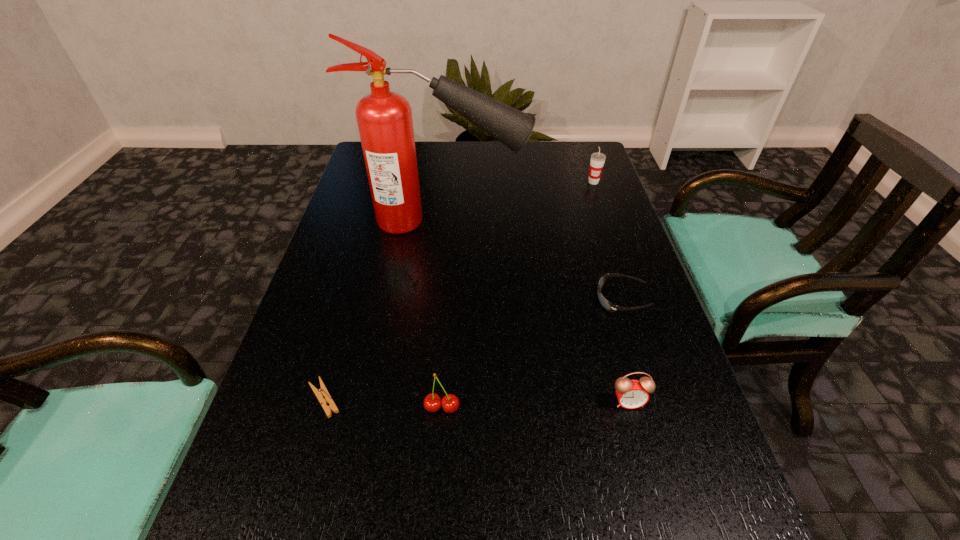
This screenshot has height=540, width=960. What are the coordinates of `cup that is at the right edge` in the screenshot? It's located at [597, 161].

Find the location of a particular element. alarm clock located at the right edge is located at coordinates (631, 394).

Where is `sunglasses situated at the right edge`? The image size is (960, 540). sunglasses situated at the right edge is located at coordinates (606, 304).

The height and width of the screenshot is (540, 960). Find the location of `object located in the far right corner section of the desktop`. object located in the far right corner section of the desktop is located at coordinates (597, 161).

Locate an element on the screen. vacant area at the far edge is located at coordinates (543, 172).

Where is `free space at the left edge of the desktop`? free space at the left edge of the desktop is located at coordinates (350, 259).

The width and height of the screenshot is (960, 540). In order to click on vacant region at the right edge of the desktop in this screenshot , I will do `click(611, 230)`.

In the image, there is a desktop. What are the coordinates of `vacant space at the far left corner` in the screenshot? It's located at (356, 173).

Identify the location of free space between the alarm clock and the cherry. This screenshot has width=960, height=540. (536, 404).

Where is `empty space between the shortest object and the alarm clock`? This screenshot has height=540, width=960. empty space between the shortest object and the alarm clock is located at coordinates (476, 400).